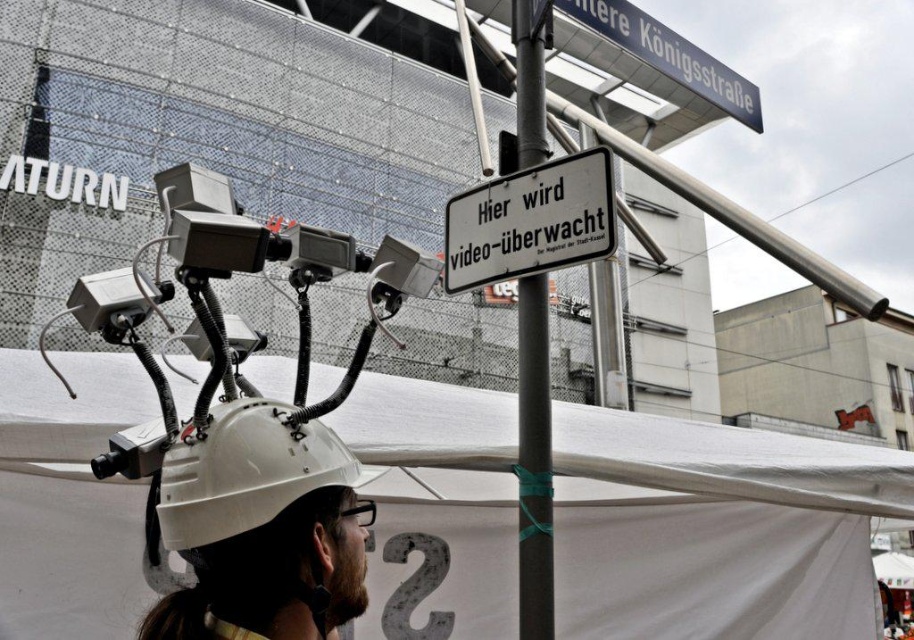
Question: Which of the following is the closest to the observer?

Choices:
 (A) (373, 586)
 (B) (199, 488)

Answer: (B)

Question: Can you confirm if silver metallic cameras at upper center is positioned to the left of white plastic sign at upper center?

Choices:
 (A) yes
 (B) no

Answer: (A)

Question: Which point is closer to the camera taking this photo?

Choices:
 (A) (654, 60)
 (B) (360, 573)

Answer: (B)

Question: Where is white fabric tent at center located in relation to silver metallic cameras at upper center in the image?

Choices:
 (A) right
 (B) left

Answer: (A)

Question: Which point appears farthest from the camera in this image?

Choices:
 (A) (742, 109)
 (B) (151, 621)
 (C) (578, 184)

Answer: (A)

Question: Is white hard hat at center thinner than metallic pole at center?

Choices:
 (A) no
 (B) yes

Answer: (A)